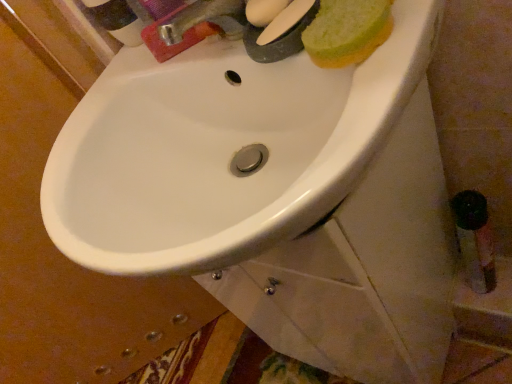
The width and height of the screenshot is (512, 384). In order to click on green sponge at upper right in this screenshot , I will do [347, 31].

This screenshot has width=512, height=384. What do you see at coordinates (205, 19) in the screenshot? I see `metallic silver faucet at upper center` at bounding box center [205, 19].

What do you see at coordinates (220, 150) in the screenshot?
I see `white glossy sink at center` at bounding box center [220, 150].

At what (x,y) coordinates should I click in order to perform the action: click on green sponge at upper right. Please return your answer as a coordinate pair (x, y). Looking at the image, I should click on (347, 31).

Choose the correct answer: Is white glossy sink at center inside green sponge at upper right or outside it?

white glossy sink at center is not inside green sponge at upper right, it's outside.

Is point (78, 236) less distant than point (346, 50)?

No, (78, 236) is behind (346, 50).

Is white glossy sink at center to the left or to the right of green sponge at upper right in the image?

white glossy sink at center is positioned on green sponge at upper right's left side.

In the image, there is a green sponge at upper right. Where is `sink below it (from a real-world perspective)`? sink below it (from a real-world perspective) is located at coordinates (220, 150).

Is green sponge at upper right further to camera compared to metallic silver faucet at upper center?

That is False.

Is metallic silver faucet at upper center located within green sponge at upper right?

That's incorrect, metallic silver faucet at upper center is not inside green sponge at upper right.

Does green sponge at upper right turn towards metallic silver faucet at upper center?

No.

Identify the location of sink that is below the green sponge at upper right (from the image's perspective). The width and height of the screenshot is (512, 384). [220, 150].

Are green sponge at upper right and white glossy sink at center making contact?

There is a gap between green sponge at upper right and white glossy sink at center.

From a real-world perspective, between green sponge at upper right and white glossy sink at center, who is vertically higher?

green sponge at upper right is physically above.

From the image's perspective, would you say green sponge at upper right is shown under white glossy sink at center?

No.

Visually, is metallic silver faucet at upper center positioned to the left or to the right of green sponge at upper right?

metallic silver faucet at upper center is to the left of green sponge at upper right.

Is metallic silver faucet at upper center aimed at green sponge at upper right?

No.

Looking at this image, are metallic silver faucet at upper center and green sponge at upper right located far from each other?

No, metallic silver faucet at upper center is not far away from green sponge at upper right.

Where is `tap behind the green sponge at upper right`? The width and height of the screenshot is (512, 384). tap behind the green sponge at upper right is located at coordinates click(205, 19).

Is the surface of white glossy sink at center in direct contact with metallic silver faucet at upper center?

No, white glossy sink at center is not with metallic silver faucet at upper center.

At what (x,y) coordinates should I click in order to perform the action: click on tap on the left of white glossy sink at center. Please return your answer as a coordinate pair (x, y). Image resolution: width=512 pixels, height=384 pixels. Looking at the image, I should click on (205, 19).

Is white glossy sink at center facing towards metallic silver faucet at upper center?

No.

From the image's perspective, which is below, white glossy sink at center or metallic silver faucet at upper center?

white glossy sink at center appears lower in the image.

Does point (164, 34) come in front of point (150, 158)?

Yes, it is in front of point (150, 158).

From the image's perspective, who appears lower, metallic silver faucet at upper center or white glossy sink at center?

white glossy sink at center.

From a real-world perspective, who is located higher, metallic silver faucet at upper center or white glossy sink at center?

From a 3D spatial view, metallic silver faucet at upper center is above.

Can you confirm if metallic silver faucet at upper center is shorter than white glossy sink at center?

Yes.

The image size is (512, 384). In order to click on sink that is in front of the green sponge at upper right in this screenshot , I will do `click(220, 150)`.

I want to click on tap lying above the green sponge at upper right (from the image's perspective), so click(x=205, y=19).

Looking at the image, which one is located further to green sponge at upper right, white glossy sink at center or metallic silver faucet at upper center?

white glossy sink at center is further to green sponge at upper right.

From the picture: Looking at the image, which one is located further to white glossy sink at center, metallic silver faucet at upper center or green sponge at upper right?

Based on the image, green sponge at upper right appears to be further to white glossy sink at center.

Which object lies further to the anchor point green sponge at upper right, metallic silver faucet at upper center or white glossy sink at center?

Among the two, white glossy sink at center is located further to green sponge at upper right.

Looking at this image, which object lies nearer to the anchor point metallic silver faucet at upper center, white glossy sink at center or green sponge at upper right?

green sponge at upper right is closer to metallic silver faucet at upper center.

Looking at the image, which one is located closer to metallic silver faucet at upper center, green sponge at upper right or white glossy sink at center?

The object closer to metallic silver faucet at upper center is green sponge at upper right.

Estimate the real-world distances between objects in this image. Which object is further from white glossy sink at center, green sponge at upper right or metallic silver faucet at upper center?

green sponge at upper right is positioned further to the anchor white glossy sink at center.

You are a GUI agent. You are given a task and a screenshot of the screen. Output one action in this format:
    pyautogui.click(x=<x>, y=<y>)
    Task: Click on the food between metallic silver faucet at upper center and white glossy sink at center vertically
    
    Given the screenshot: What is the action you would take?
    pyautogui.click(x=347, y=31)